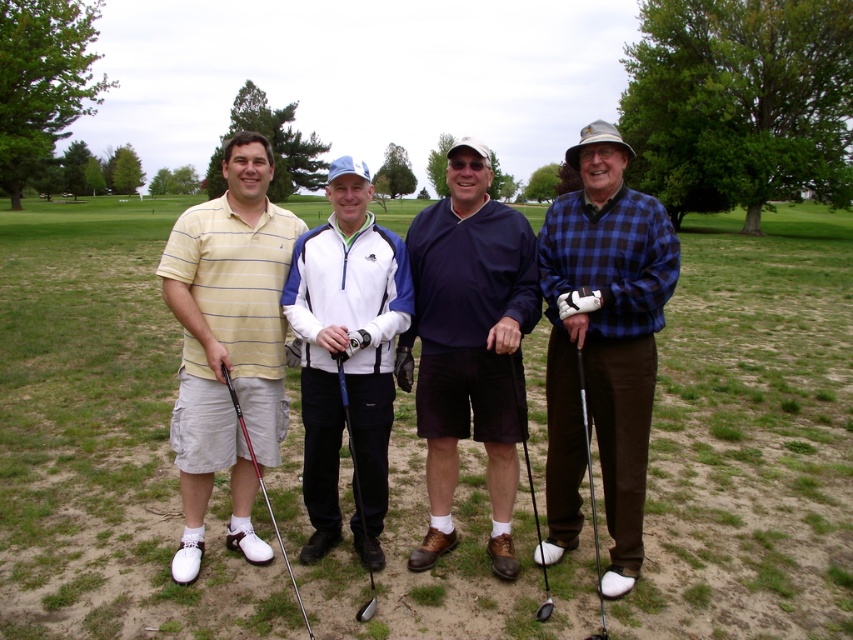
You are standing at the origin of a coordinate system placed at the bottom left corner of the image. You see a point labeled as point (103, 440). What is the location of this point relative to the green grass at center?

The point (103, 440) corresponds to the green grass at center, so it is located exactly at the center of the green grass.

You are a photographer standing behind the group of golfers. You need to take a photo that includes both the navy blue sweater at center and the metallic blue golf club at center. Based on their positions, which object should be placed to the left in the frame to ensure both are visible?

The metallic blue golf club at center should be placed to the left in the frame because the navy blue sweater at center is to the right of the metallic blue golf club at center.